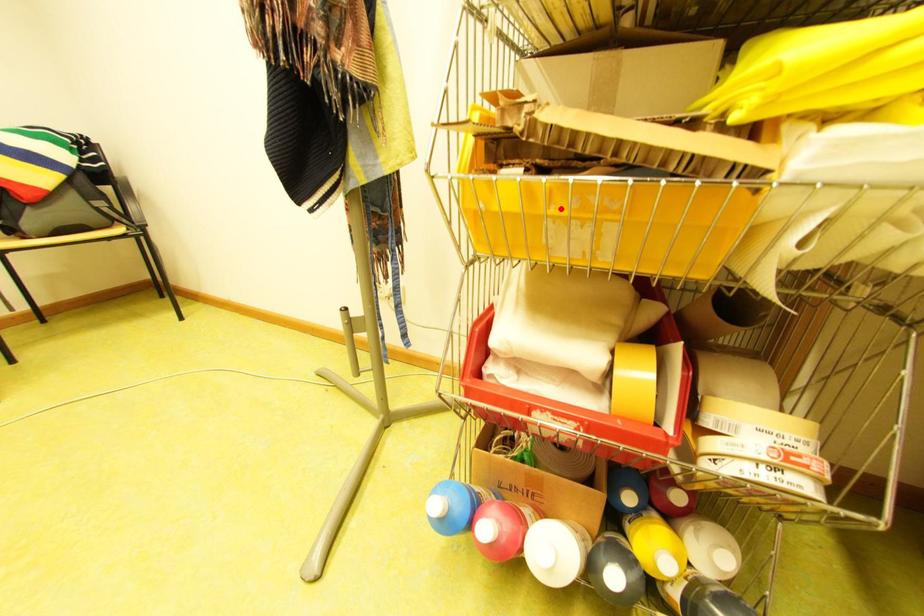
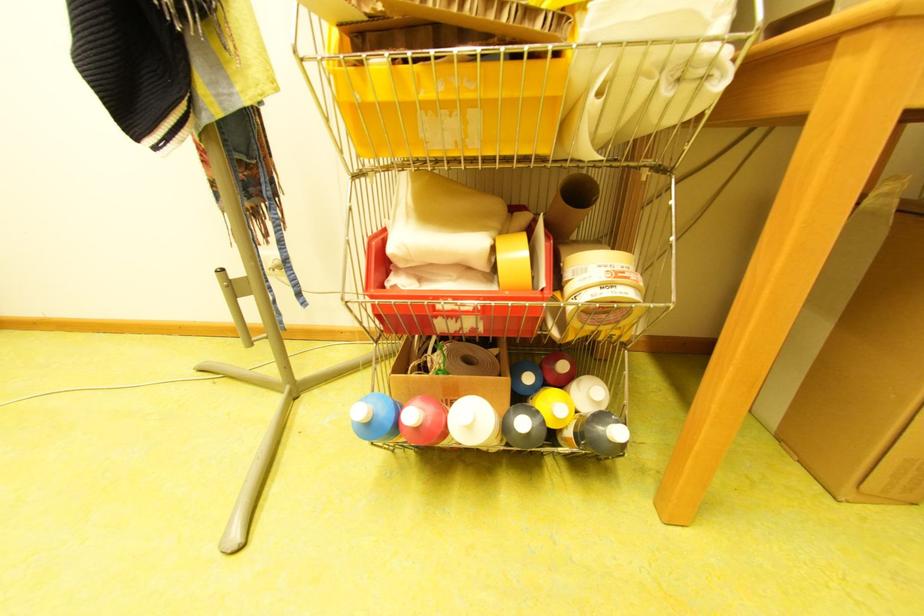
Locate, in the second image, the point that corresponds to the highlighted location in the first image.

(429, 95)